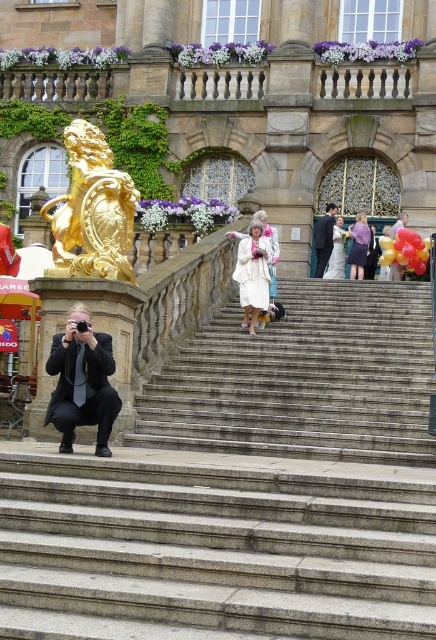
I want to click on goldmetalliclion at left, so click(252, 97).

Is white fur coat at center bigger than purple fabric dress at upper center?

Actually, white fur coat at center might be smaller than purple fabric dress at upper center.

Can you confirm if white fur coat at center is positioned above purple fabric dress at upper center?

No.

What do you see at coordinates (252, 275) in the screenshot? I see `white fur coat at center` at bounding box center [252, 275].

You are a GUI agent. You are given a task and a screenshot of the screen. Output one action in this format:
    pyautogui.click(x=<x>, y=<y>)
    Task: Click on the white fur coat at center
    The width and height of the screenshot is (436, 640).
    Given the screenshot: What is the action you would take?
    pyautogui.click(x=252, y=275)

Which is above, gold polished lion at upper center or purple fabric dress at upper center?

Positioned higher is gold polished lion at upper center.

Locate an element on the screen. Image resolution: width=436 pixels, height=640 pixels. gold polished lion at upper center is located at coordinates (92, 209).

The image size is (436, 640). I want to click on gold polished lion at upper center, so click(92, 209).